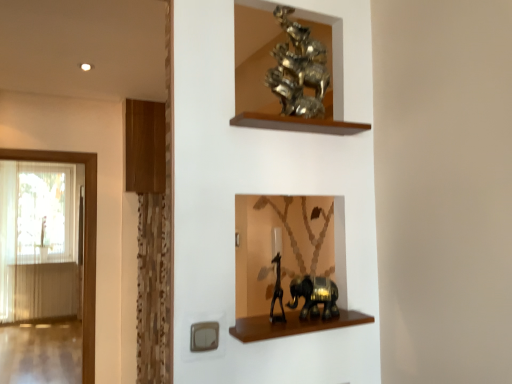
Measure the distance between wooden at left, marked as the second shelf in a bottom-to-top arrangement, and camera.

The distance of wooden at left, marked as the second shelf in a bottom-to-top arrangement, from camera is 10.80 feet.

Identify the location of metallic gold giraffe at lower center, the 2th animal in the top-to-bottom sequence. (277, 292).

The height and width of the screenshot is (384, 512). What do you see at coordinates (298, 69) in the screenshot?
I see `gold metallic sculpture at upper center, placed as the third animal when sorted from bottom to top` at bounding box center [298, 69].

Locate an element on the screen. Image resolution: width=512 pixels, height=384 pixels. wooden at left, the first shelf when ordered from left to right is located at coordinates (145, 147).

From the image's perspective, is gold metallic sculpture at upper center, arranged as the 1th animal when viewed from the top, over wooden at left, placed as the second shelf when sorted from right to left?

Yes, from the image's perspective, gold metallic sculpture at upper center, arranged as the 1th animal when viewed from the top, is over wooden at left, placed as the second shelf when sorted from right to left.

You are a GUI agent. You are given a task and a screenshot of the screen. Output one action in this format:
    pyautogui.click(x=<x>, y=<y>)
    Task: Click on the shelf to the left of gold metallic sculpture at upper center, placed as the third animal when sorted from bottom to top
    The height and width of the screenshot is (384, 512).
    Given the screenshot: What is the action you would take?
    pyautogui.click(x=145, y=147)

Are gold metallic sculpture at upper center, placed as the third animal when sorted from bottom to top, and wooden at left, marked as the second shelf in a bottom-to-top arrangement, far apart?

Yes, gold metallic sculpture at upper center, placed as the third animal when sorted from bottom to top, and wooden at left, marked as the second shelf in a bottom-to-top arrangement, are located far from each other.

In the scene shown: Is shiny black elephant at lower center, the first animal from the bottom, beside wooden at left, the 1th shelf in the top-to-bottom sequence?

No.

Relative to wooden at left, the second shelf positioned from the front, is shiny black elephant at lower center, arranged as the 3th animal when viewed from the top, in front or behind?

shiny black elephant at lower center, arranged as the 3th animal when viewed from the top, is in front of wooden at left, the second shelf positioned from the front.

Considering the sizes of shiny black elephant at lower center, the first animal from the bottom, and wooden at left, arranged as the first shelf when viewed from the back, in the image, is shiny black elephant at lower center, the first animal from the bottom, taller or shorter than wooden at left, arranged as the first shelf when viewed from the back,?

Considering their sizes, shiny black elephant at lower center, the first animal from the bottom, has less height than wooden at left, arranged as the first shelf when viewed from the back.

Is point (319, 302) farther from camera compared to point (162, 174)?

No, it is in front of (162, 174).

Consider the image. How many degrees apart are the facing directions of wooden at left, arranged as the first shelf when viewed from the back, and shiny black elephant at lower center, the first animal from the bottom?

There is a 3.1-degree angle between the facing directions of wooden at left, arranged as the first shelf when viewed from the back, and shiny black elephant at lower center, the first animal from the bottom.

Where is `shelf above the shiny black elephant at lower center, arranged as the 3th animal when viewed from the top (from the image's perspective)`? Image resolution: width=512 pixels, height=384 pixels. shelf above the shiny black elephant at lower center, arranged as the 3th animal when viewed from the top (from the image's perspective) is located at coordinates (145, 147).

Could you measure the distance between wooden at left, the first shelf when ordered from left to right, and shiny black elephant at lower center, arranged as the 3th animal when viewed from the top?

wooden at left, the first shelf when ordered from left to right, and shiny black elephant at lower center, arranged as the 3th animal when viewed from the top, are 2.25 meters apart from each other.

Is wooden at left, placed as the second shelf when sorted from right to left, aimed at shiny black elephant at lower center, arranged as the 3th animal when viewed from the top?

Yes, wooden at left, placed as the second shelf when sorted from right to left, faces towards shiny black elephant at lower center, arranged as the 3th animal when viewed from the top.

Between metallic gold giraffe at lower center, the 2th animal in the top-to-bottom sequence, and translucent glass door at left, which one has larger width?

metallic gold giraffe at lower center, the 2th animal in the top-to-bottom sequence, is wider.

Looking at this image, is metallic gold giraffe at lower center, the 2th animal in the top-to-bottom sequence, spatially inside translucent glass door at left, or outside of it?

The correct answer is: outside.

Visually, is metallic gold giraffe at lower center, the 2th animal in the top-to-bottom sequence, positioned to the left or to the right of translucent glass door at left?

In the image, metallic gold giraffe at lower center, the 2th animal in the top-to-bottom sequence, appears on the right side of translucent glass door at left.

From a real-world perspective, is metallic gold giraffe at lower center, which ranks as the 2th animal in bottom-to-top order, below translucent glass door at left?

No, from a real-world perspective, metallic gold giraffe at lower center, which ranks as the 2th animal in bottom-to-top order, is not under translucent glass door at left.

Which object is further away from the camera, translucent glass door at left or shiny black elephant at lower center, arranged as the 3th animal when viewed from the top?

translucent glass door at left is more distant.

Considering the sizes of translucent glass door at left and shiny black elephant at lower center, arranged as the 3th animal when viewed from the top, in the image, is translucent glass door at left wider or thinner than shiny black elephant at lower center, arranged as the 3th animal when viewed from the top,?

Considering their sizes, translucent glass door at left looks slimmer than shiny black elephant at lower center, arranged as the 3th animal when viewed from the top.

Is translucent glass door at left outside of shiny black elephant at lower center, arranged as the 3th animal when viewed from the top?

Yes, translucent glass door at left is outside of shiny black elephant at lower center, arranged as the 3th animal when viewed from the top.

Is translucent glass door at left not close to shiny black elephant at lower center, the first animal from the bottom?

translucent glass door at left is positioned a significant distance from shiny black elephant at lower center, the first animal from the bottom.

Identify the location of shelf below the wooden at left, the first shelf when ordered from left to right (from the image's perspective). The height and width of the screenshot is (384, 512). (292, 325).

Considering the relative sizes of brown wooden shelf at lower center, the first shelf when ordered from bottom to top, and wooden at left, marked as the second shelf in a bottom-to-top arrangement, in the image provided, is brown wooden shelf at lower center, the first shelf when ordered from bottom to top, thinner than wooden at left, marked as the second shelf in a bottom-to-top arrangement,?

Correct, the width of brown wooden shelf at lower center, the first shelf when ordered from bottom to top, is less than that of wooden at left, marked as the second shelf in a bottom-to-top arrangement.

Which of these two, brown wooden shelf at lower center, the second shelf viewed from the back, or wooden at left, placed as the second shelf when sorted from right to left, stands shorter?

Standing shorter between the two is brown wooden shelf at lower center, the second shelf viewed from the back.

Does brown wooden shelf at lower center, which appears as the 1th shelf when viewed from the right, have a larger size compared to wooden at left, the first shelf when ordered from left to right?

No, brown wooden shelf at lower center, which appears as the 1th shelf when viewed from the right, is not bigger than wooden at left, the first shelf when ordered from left to right.

Is brown wooden shelf at lower center, the second shelf in the left-to-right sequence, surrounding translucent glass door at left?

No, translucent glass door at left is located outside of brown wooden shelf at lower center, the second shelf in the left-to-right sequence.

Is brown wooden shelf at lower center, which ranks as the second shelf in top-to-bottom order, wider than translucent glass door at left?

Yes.

From the image's perspective, who appears lower, brown wooden shelf at lower center, which appears as the 1th shelf when viewed from the right, or translucent glass door at left?

translucent glass door at left.

This screenshot has width=512, height=384. I want to click on window lying below the brown wooden shelf at lower center, the first shelf when ordered from bottom to top (from the image's perspective), so click(x=85, y=240).

At what (x,y) coordinates should I click in order to perform the action: click on animal that is the 2nd object located in front of the wooden at left, the second shelf positioned from the front. Please return your answer as a coordinate pair (x, y). Looking at the image, I should click on (298, 69).

There is a wooden at left, marked as the second shelf in a bottom-to-top arrangement. Identify the location of the 3rd animal below it (from a real-world perspective). The width and height of the screenshot is (512, 384). (315, 296).

Considering their positions, is gold metallic sculpture at upper center, arranged as the 1th animal when viewed from the top, positioned closer to metallic gold giraffe at lower center, the 2th animal in the top-to-bottom sequence, than translucent glass door at left?

gold metallic sculpture at upper center, arranged as the 1th animal when viewed from the top, lies closer to metallic gold giraffe at lower center, the 2th animal in the top-to-bottom sequence, than the other object.

From the image, which object appears to be farther from gold metallic sculpture at upper center, placed as the third animal when sorted from bottom to top, metallic gold giraffe at lower center, the 2th animal in the top-to-bottom sequence, or translucent glass door at left?

Based on the image, translucent glass door at left appears to be further to gold metallic sculpture at upper center, placed as the third animal when sorted from bottom to top.

Looking at the image, which one is located further to shiny black elephant at lower center, arranged as the 3th animal when viewed from the top, gold metallic sculpture at upper center, placed as the third animal when sorted from bottom to top, or metallic gold giraffe at lower center, which ranks as the 2th animal in bottom-to-top order?

gold metallic sculpture at upper center, placed as the third animal when sorted from bottom to top.

When comparing their distances from translucent glass door at left, does gold metallic sculpture at upper center, arranged as the 1th animal when viewed from the top, or metallic gold giraffe at lower center, the 2th animal in the top-to-bottom sequence, seem closer?

Based on the image, metallic gold giraffe at lower center, the 2th animal in the top-to-bottom sequence, appears to be nearer to translucent glass door at left.

Estimate the real-world distances between objects in this image. Which object is further from brown wooden shelf at lower center, the second shelf viewed from the back, shiny black elephant at lower center, the first animal from the bottom, or translucent glass door at left?

translucent glass door at left is positioned further to the anchor brown wooden shelf at lower center, the second shelf viewed from the back.

Estimate the real-world distances between objects in this image. Which object is further from shiny black elephant at lower center, arranged as the 3th animal when viewed from the top, metallic gold giraffe at lower center, the 2th animal in the top-to-bottom sequence, or gold metallic sculpture at upper center, placed as the third animal when sorted from bottom to top?

gold metallic sculpture at upper center, placed as the third animal when sorted from bottom to top, is further to shiny black elephant at lower center, arranged as the 3th animal when viewed from the top.

When comparing their distances from wooden at left, marked as the second shelf in a bottom-to-top arrangement, does brown wooden shelf at lower center, which ranks as the second shelf in top-to-bottom order, or metallic gold giraffe at lower center, the 2th animal in the top-to-bottom sequence, seem further?

brown wooden shelf at lower center, which ranks as the second shelf in top-to-bottom order, lies further to wooden at left, marked as the second shelf in a bottom-to-top arrangement, than the other object.

From the picture: Estimate the real-world distances between objects in this image. Which object is closer to wooden at left, arranged as the first shelf when viewed from the back, translucent glass door at left or brown wooden shelf at lower center, the second shelf in the left-to-right sequence?

Based on the image, translucent glass door at left appears to be nearer to wooden at left, arranged as the first shelf when viewed from the back.

Where is `animal between gold metallic sculpture at upper center, placed as the third animal when sorted from bottom to top, and shiny black elephant at lower center, arranged as the 3th animal when viewed from the top, from top to bottom`? The width and height of the screenshot is (512, 384). animal between gold metallic sculpture at upper center, placed as the third animal when sorted from bottom to top, and shiny black elephant at lower center, arranged as the 3th animal when viewed from the top, from top to bottom is located at coordinates (277, 292).

Locate an element on the screen. window between gold metallic sculpture at upper center, placed as the third animal when sorted from bottom to top, and wooden at left, the second shelf positioned from the front, from front to back is located at coordinates (85, 240).

Where is `window located between brown wooden shelf at lower center, the first shelf positioned from the front, and wooden at left, placed as the second shelf when sorted from right to left, in the depth direction`? This screenshot has width=512, height=384. window located between brown wooden shelf at lower center, the first shelf positioned from the front, and wooden at left, placed as the second shelf when sorted from right to left, in the depth direction is located at coordinates (x=85, y=240).

At what (x,y) coordinates should I click in order to perform the action: click on animal between gold metallic sculpture at upper center, arranged as the 1th animal when viewed from the top, and wooden at left, the second shelf positioned from the front, from front to back. Please return your answer as a coordinate pair (x, y). Looking at the image, I should click on (315, 296).